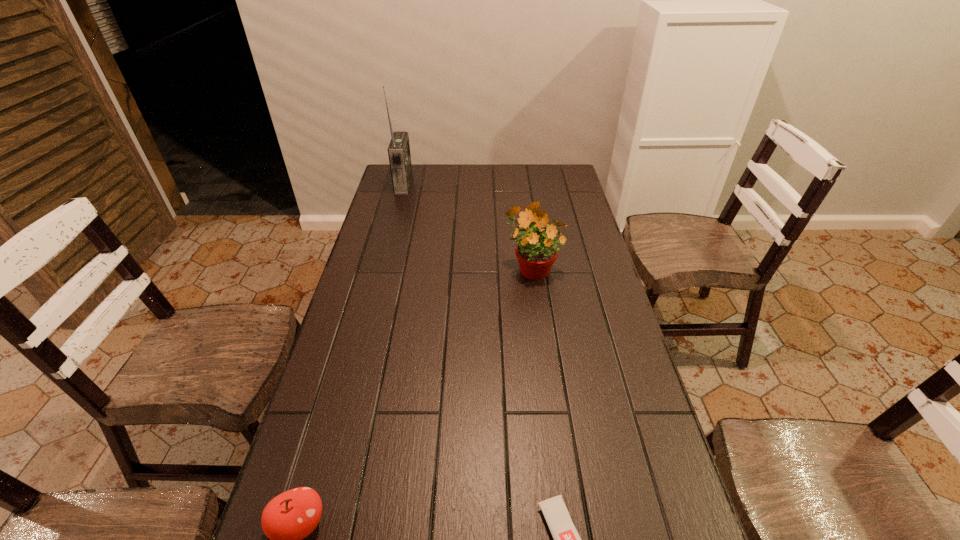
Image resolution: width=960 pixels, height=540 pixels. I want to click on radio receiver, so click(399, 154).

Identify the location of the farthest object. This screenshot has width=960, height=540. click(399, 154).

Identify the location of the third nearest object. (536, 253).

The image size is (960, 540). Identify the location of the third shortest object. (536, 253).

Image resolution: width=960 pixels, height=540 pixels. Identify the location of vacant space located on the display of the radio receiver. (473, 184).

This screenshot has height=540, width=960. I want to click on vacant space situated on the right of the second tallest object, so click(x=597, y=267).

The image size is (960, 540). I want to click on object that is positioned at the far edge, so click(x=399, y=154).

Find the location of a particular element. Image resolution: width=960 pixels, height=540 pixels. object at the left edge is located at coordinates tap(399, 154).

Identify the location of object that is at the right edge. The width and height of the screenshot is (960, 540). (536, 253).

Find the location of a particular element. Image resolution: width=960 pixels, height=540 pixels. object that is at the far left corner is located at coordinates (399, 154).